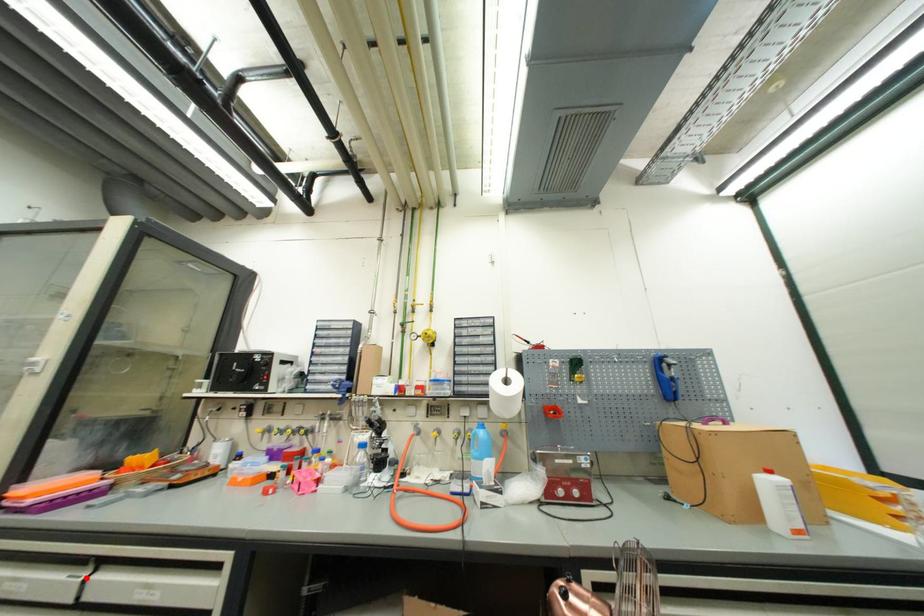
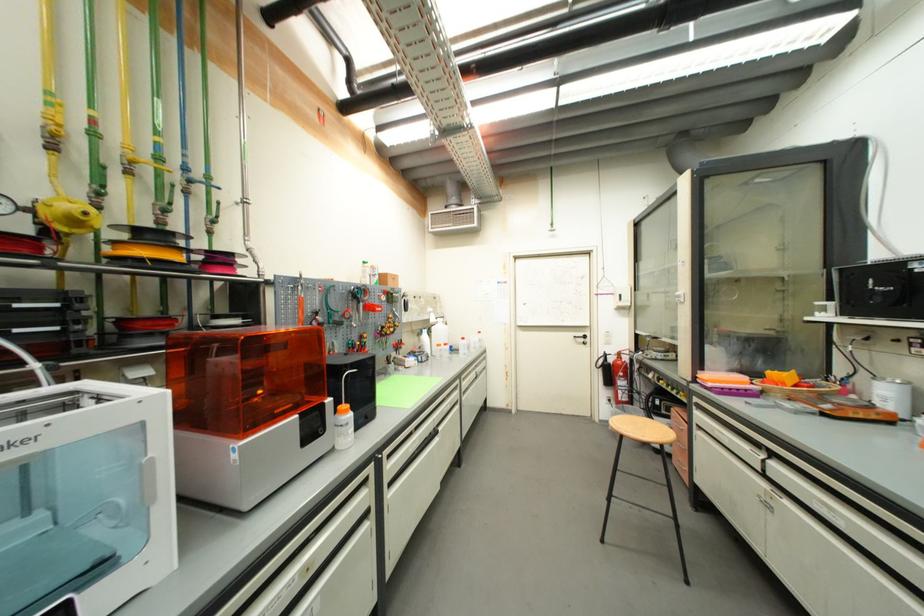
Where in the second image is the point corresponding to the highlighted location from the first image?

(764, 456)